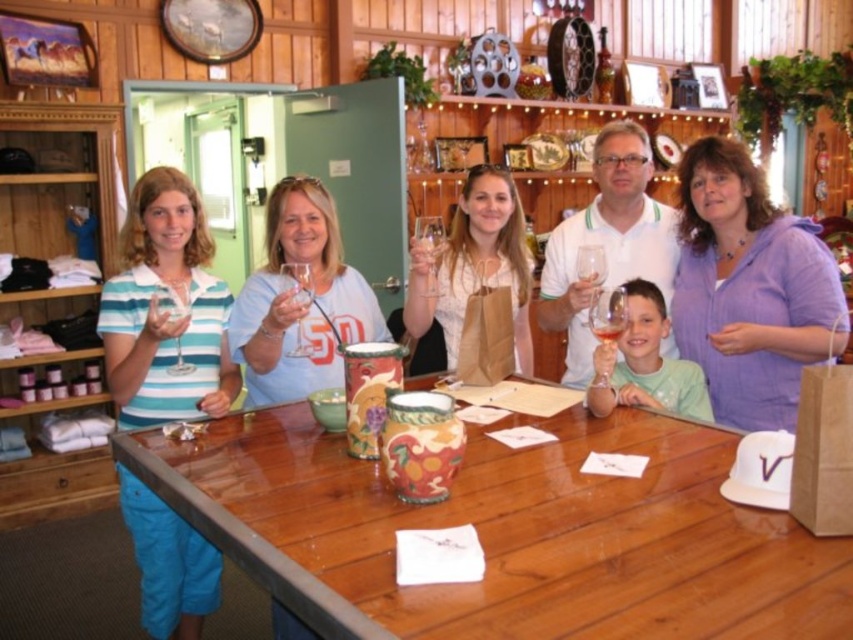
You are a photographer standing at the back of the room. You want to take a photo of the purple cotton shirt at center without anyone blocking it. The people are 5.58 feet apart. Is there enough space between the people for you to capture the shirt clearly?

The people are 5.58 feet apart, so there is sufficient space between them to ensure the purple cotton shirt at center is visible without obstruction in your photo.